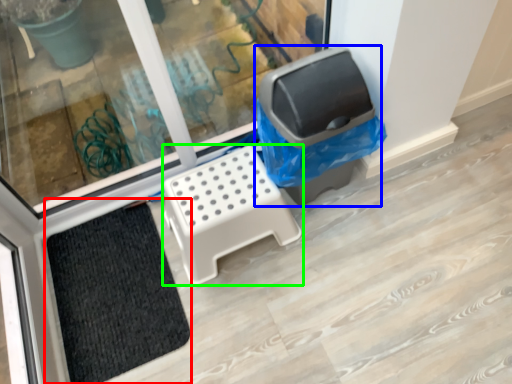
Question: Which object is positioned closest to doormat (highlighted by a red box)? Select from recycling bin (highlighted by a blue box) and furniture (highlighted by a green box).

Choices:
 (A) recycling bin
 (B) furniture

Answer: (B)